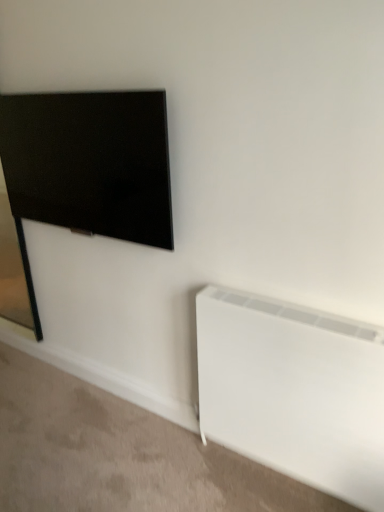
Question: Is white matte radiator at lower right bigger than matte black tv at upper left?

Choices:
 (A) yes
 (B) no

Answer: (A)

Question: From a real-world perspective, is white matte radiator at lower right over matte black tv at upper left?

Choices:
 (A) no
 (B) yes

Answer: (A)

Question: Is white matte radiator at lower right oriented towards matte black tv at upper left?

Choices:
 (A) no
 (B) yes

Answer: (A)

Question: From the image's perspective, is white matte radiator at lower right over matte black tv at upper left?

Choices:
 (A) no
 (B) yes

Answer: (A)

Question: Is white matte radiator at lower right shorter than matte black tv at upper left?

Choices:
 (A) yes
 (B) no

Answer: (B)

Question: Does white matte radiator at lower right appear on the left side of matte black tv at upper left?

Choices:
 (A) yes
 (B) no

Answer: (B)

Question: Does matte black tv at upper left have a lesser height compared to white matte radiator at lower right?

Choices:
 (A) yes
 (B) no

Answer: (A)

Question: From the image's perspective, does matte black tv at upper left appear higher than white matte radiator at lower right?

Choices:
 (A) no
 (B) yes

Answer: (B)

Question: Is matte black tv at upper left facing towards white matte radiator at lower right?

Choices:
 (A) no
 (B) yes

Answer: (A)

Question: From a real-world perspective, is matte black tv at upper left beneath white matte radiator at lower right?

Choices:
 (A) no
 (B) yes

Answer: (A)

Question: From the image's perspective, is matte black tv at upper left located beneath white matte radiator at lower right?

Choices:
 (A) no
 (B) yes

Answer: (A)

Question: Is matte black tv at upper left beside white matte radiator at lower right?

Choices:
 (A) no
 (B) yes

Answer: (A)

Question: Considering the positions of point (59, 195) and point (317, 416), is point (59, 195) closer or farther from the camera than point (317, 416)?

Choices:
 (A) farther
 (B) closer

Answer: (A)